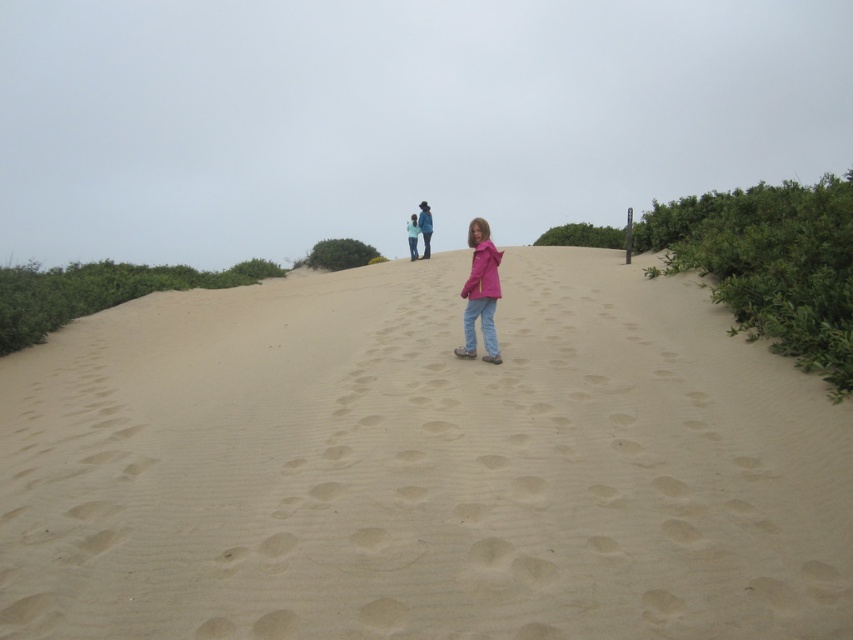
Consider the image. Does blue denim jacket at center have a lesser width compared to blue fabric jacket at upper center?

In fact, blue denim jacket at center might be wider than blue fabric jacket at upper center.

Is point (427, 205) positioned before point (413, 250)?

Yes, point (427, 205) is closer to viewer.

Between point (431, 221) and point (416, 253), which one is positioned behind?

The point (416, 253) is more distant.

Identify the location of blue denim jacket at center. (425, 227).

Can you confirm if smooth sand at center is positioned to the right of matte pink jacket at center?

No, smooth sand at center is not to the right of matte pink jacket at center.

Is smooth sand at center taller than matte pink jacket at center?

Indeed, smooth sand at center has a greater height compared to matte pink jacket at center.

Does point (26, 387) lie behind point (463, 339)?

Yes.

Where is `smooth sand at center`? The image size is (853, 640). smooth sand at center is located at coordinates (x=421, y=467).

Is matte pink jacket at center further to the viewer compared to blue denim jacket at center?

No.

Who is positioned more to the left, matte pink jacket at center or blue denim jacket at center?

Positioned to the left is blue denim jacket at center.

This screenshot has width=853, height=640. In order to click on matte pink jacket at center in this screenshot , I will do `click(480, 292)`.